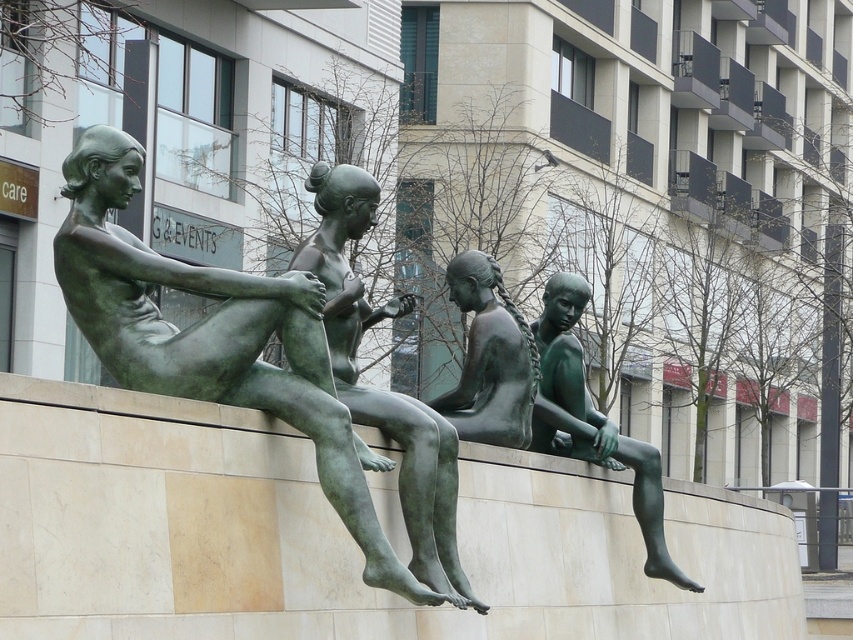
Question: Is green patina bronze sculpture at left further to camera compared to green polished bronze girl at lower right?

Choices:
 (A) yes
 (B) no

Answer: (B)

Question: Among these objects, which one is farthest from the camera?

Choices:
 (A) green bronze statue at center
 (B) green polished bronze girl at lower right

Answer: (B)

Question: Can you confirm if green patina bronze sculpture at left is positioned to the left of green patina statue at center?

Choices:
 (A) no
 (B) yes

Answer: (B)

Question: Is green patina bronze sculpture at left to the right of green bronze statue at center from the viewer's perspective?

Choices:
 (A) no
 (B) yes

Answer: (A)

Question: Estimate the real-world distances between objects in this image. Which object is closer to the green polished bronze girl at lower right?

Choices:
 (A) green patina statue at center
 (B) green patina bronze sculpture at left

Answer: (A)

Question: Which of the following is the farthest from the observer?

Choices:
 (A) green patina statue at center
 (B) green patina bronze sculpture at left
 (C) green polished bronze girl at lower right

Answer: (C)